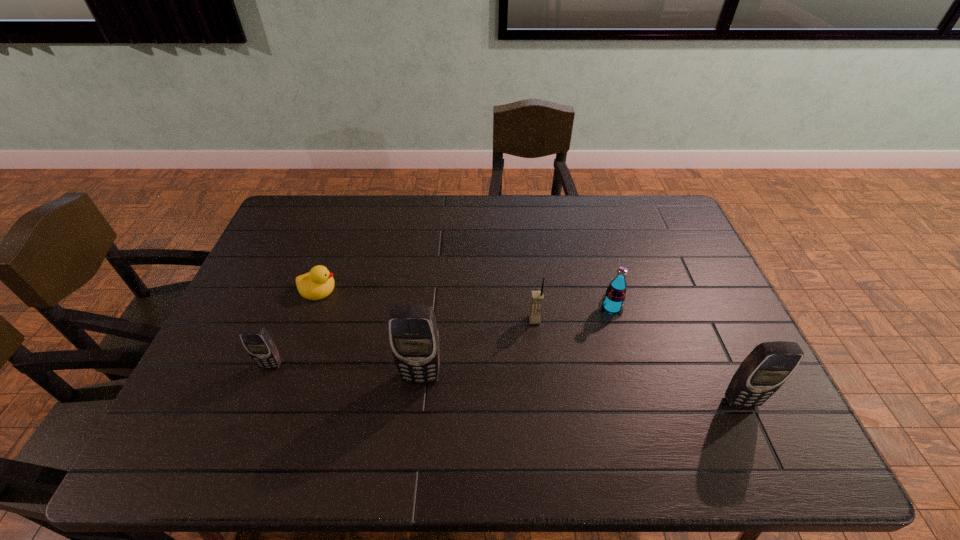
Identify the location of vacant point located between the farthest cellular telephone and the second tallest object. (637, 360).

You are a GUI agent. You are given a task and a screenshot of the screen. Output one action in this format:
    pyautogui.click(x=<x>, y=<y>)
    Task: Click on the vacant area between the second cellular telephone from left to right and the second cellular telephone from right to left
    
    Given the screenshot: What is the action you would take?
    pyautogui.click(x=478, y=348)

Find the location of a particular element. blank region between the nearest object and the duckling is located at coordinates (530, 345).

Where is `object that can be found as the fifth closest to the leftmost cellular telephone`? This screenshot has width=960, height=540. object that can be found as the fifth closest to the leftmost cellular telephone is located at coordinates (767, 367).

Identify the location of object that is the closest one to the soda. The width and height of the screenshot is (960, 540). (537, 297).

Locate an element on the screen. This screenshot has width=960, height=540. the closest cellular telephone to the rightmost object is located at coordinates (537, 297).

Identify the location of cellular telephone that stands as the third closest to the second cellular telephone from left to right. (767, 367).

Where is `blank area in the image that satisfies the following two spatial constraints: 1. on the face of the duckling; 2. on the back side of the second object from right to left`? The width and height of the screenshot is (960, 540). blank area in the image that satisfies the following two spatial constraints: 1. on the face of the duckling; 2. on the back side of the second object from right to left is located at coordinates (312, 307).

You are a GUI agent. You are given a task and a screenshot of the screen. Output one action in this format:
    pyautogui.click(x=<x>, y=<y>)
    Task: Click on the free location that satisfies the following two spatial constraints: 1. on the face of the duckling; 2. on the back side of the soda
    The width and height of the screenshot is (960, 540).
    Given the screenshot: What is the action you would take?
    pyautogui.click(x=312, y=307)